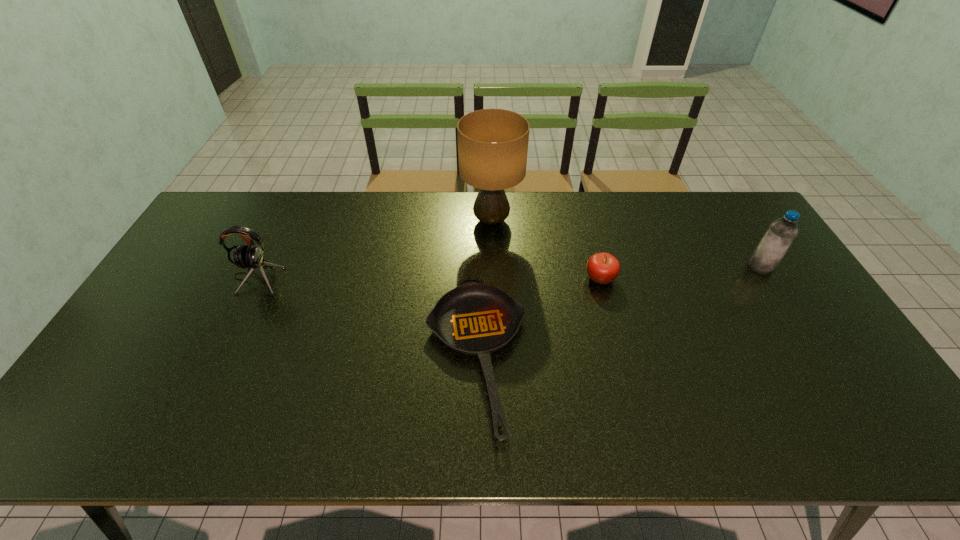
Where is `vacant area situated 0.390m on the left of the apple`? vacant area situated 0.390m on the left of the apple is located at coordinates (455, 278).

At what (x,y) coordinates should I click in order to perform the action: click on vacant point located 0.350m on the back of the frying pan. Please return your answer as a coordinate pair (x, y). Image resolution: width=960 pixels, height=540 pixels. Looking at the image, I should click on (477, 213).

What are the coordinates of `object that is at the far edge` in the screenshot? It's located at (492, 143).

Where is `object located at the near edge`? The image size is (960, 540). object located at the near edge is located at coordinates (475, 319).

What are the coordinates of `object that is at the right edge` in the screenshot? It's located at (781, 233).

Find the location of `free space at the far edge`. free space at the far edge is located at coordinates (547, 195).

What are the coordinates of `free space at the near edge of the desktop` in the screenshot? It's located at (786, 440).

At what (x,y) coordinates should I click in order to perform the action: click on vacant region at the right edge of the desktop. Please return your answer as a coordinate pair (x, y). The width and height of the screenshot is (960, 540). Looking at the image, I should click on (720, 239).

The width and height of the screenshot is (960, 540). Identify the location of vacant space at the far right corner of the desktop. (732, 221).

Identify the location of empty location between the rightmost object and the frying pan. The image size is (960, 540). (618, 311).